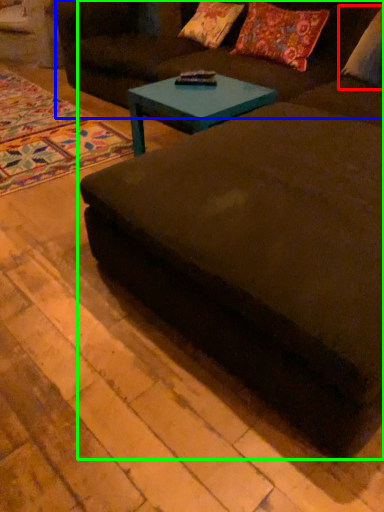
Question: Which object is positioned closest to pillow (highlighted by a red box)? Select from couch (highlighted by a blue box) and studio couch (highlighted by a green box).

Choices:
 (A) couch
 (B) studio couch

Answer: (A)